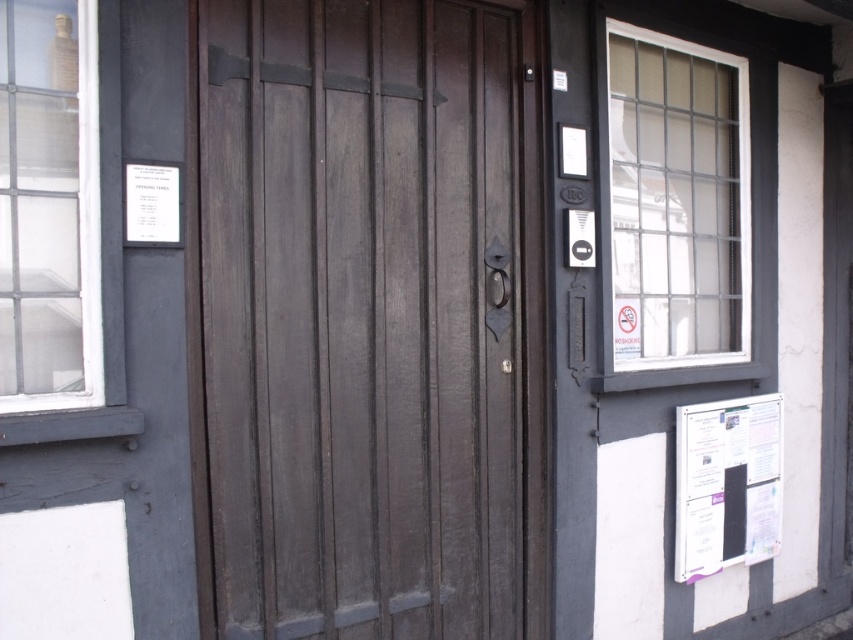
You are a delivery person trying to hand a package to the office at the dark wood door at center. The window at upper left is closed. Can you see the person inside through the clear glass window at upper left to confirm if they are present?

The clear glass window at upper left is present but since it is closed, you cannot see through it to confirm if someone is present inside.

You are standing in front of the building shown in the image. The point at coordinates (373, 317) is marked on the door. If you were to walk directly towards the door, would this point be located on the left half or the right half of the door?

The point at coordinates (373, 317) is on the dark wood door at center. Since the coordinate system typically places 0.5 as the center point, 0.498 is very close to the center, slightly to the left. Therefore, this point would be on the left half of the door.

You are standing in front of the building and want to enter through the dark wood door at center. To do so, you need to walk past the clear glass window at upper left. Can you walk directly towards the door without moving around the window?

The dark wood door at center is further to the viewer than clear glass window at upper left, so you can walk directly towards the door without needing to move around the window since the window is behind the door from your perspective.